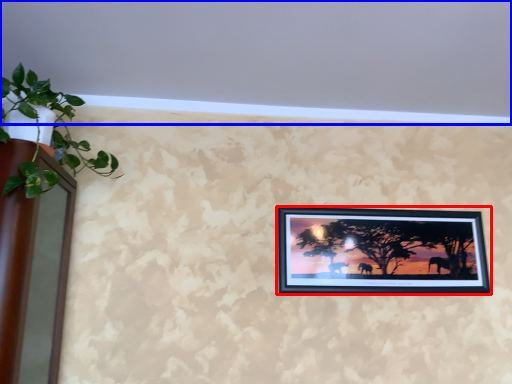
Question: Which object is further to the camera taking this photo, picture frame (highlighted by a red box) or backdrop (highlighted by a blue box)?

Choices:
 (A) picture frame
 (B) backdrop

Answer: (A)